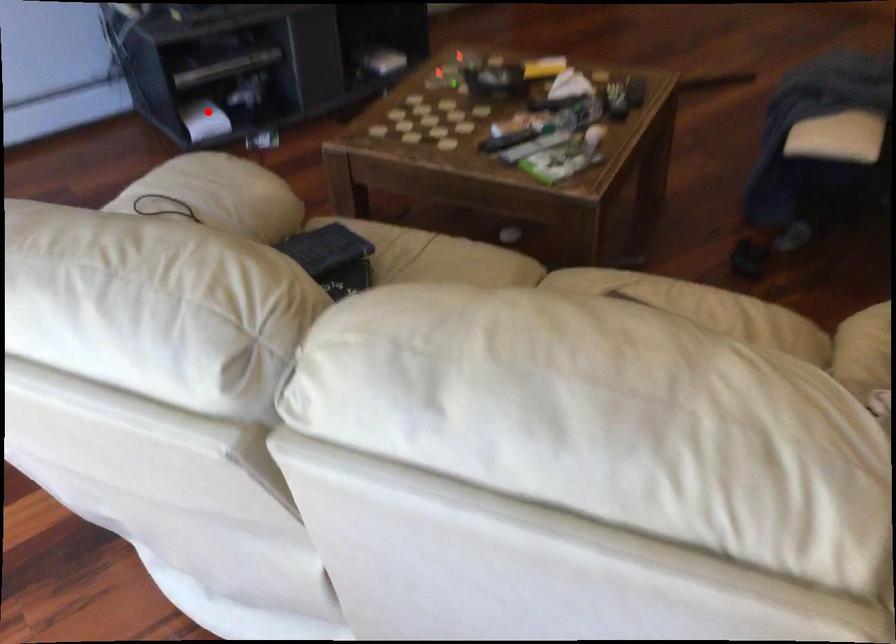
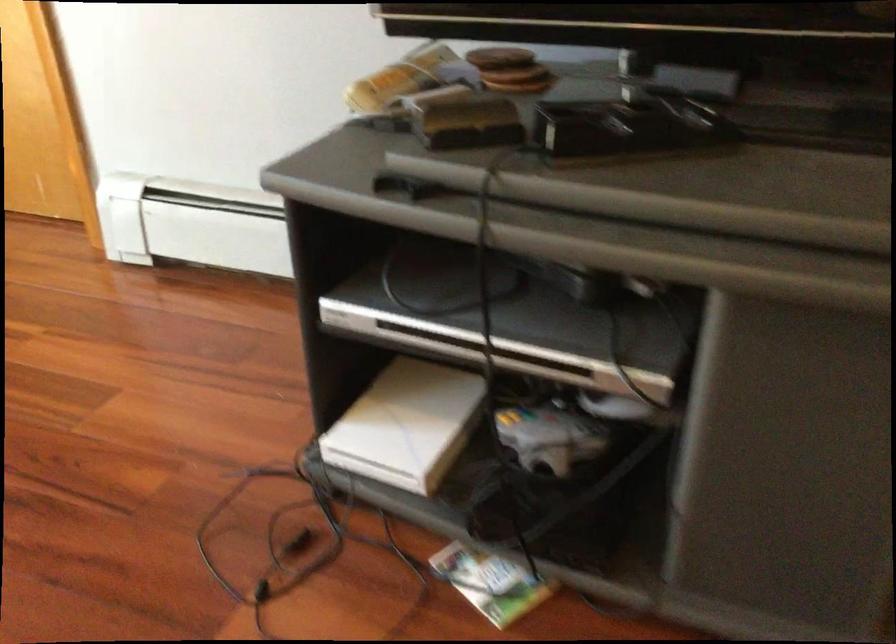
Question: I am providing you with two images of the same scene from different viewpoints. Image1 has a red point marked. In image2, the corresponding 3D location appears at what relative position? Reply with the corresponding letter.

Choices:
 (A) Closer
 (B) Farther

Answer: (A)